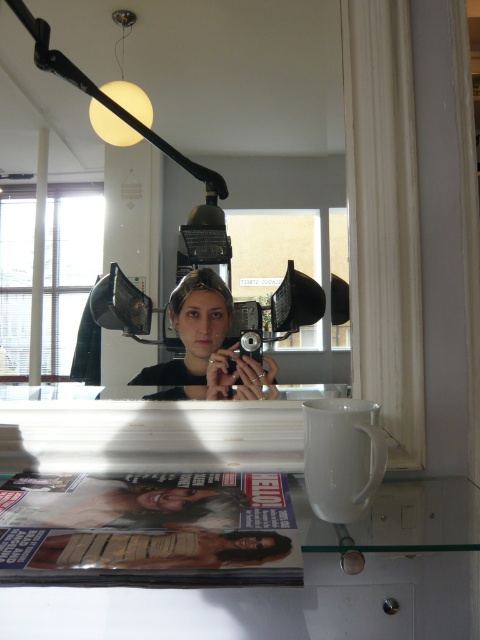
Question: Is the position of white glossy mirror at upper center more distant than that of matte black magazine at lower center?

Choices:
 (A) no
 (B) yes

Answer: (B)

Question: Can you confirm if matte plastic magazine at lower center is smaller than matte black camera at center?

Choices:
 (A) no
 (B) yes

Answer: (A)

Question: Which point is farther to the camera?

Choices:
 (A) wooden magazine at lower center
 (B) matte plastic magazine at lower center
 (C) white glossy mirror at upper center
 (D) matte black magazine at lower center

Answer: (C)

Question: Which object is positioned farthest from the matte black magazine at lower center?

Choices:
 (A) white glossy mirror at upper center
 (B) wooden magazine at lower center
 (C) matte plastic magazine at lower center

Answer: (A)

Question: Does matte black camera at center have a larger size compared to wooden magazine at lower center?

Choices:
 (A) yes
 (B) no

Answer: (A)

Question: Which object appears closest to the camera in this image?

Choices:
 (A) matte black camera at center
 (B) matte black magazine at lower center

Answer: (B)